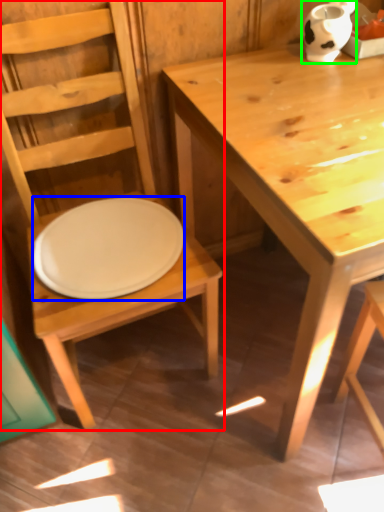
Question: Estimate the real-world distances between objects in this image. Which object is farther from chair (highlighted by a red box), plate (highlighted by a blue box) or vase (highlighted by a green box)?

Choices:
 (A) plate
 (B) vase

Answer: (B)